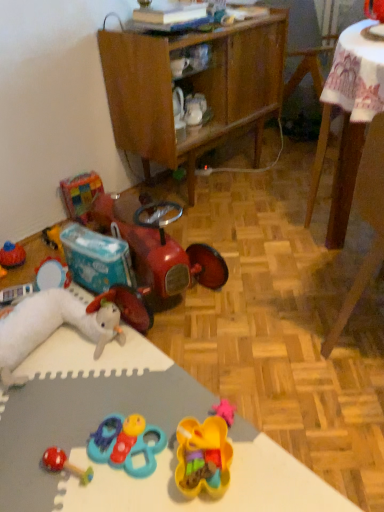
Image resolution: width=384 pixels, height=512 pixels. I want to click on vacant space in between wooden cabinet at upper center and rubberized red car at lower left, placed as the fourth toy when sorted from right to left, so click(240, 221).